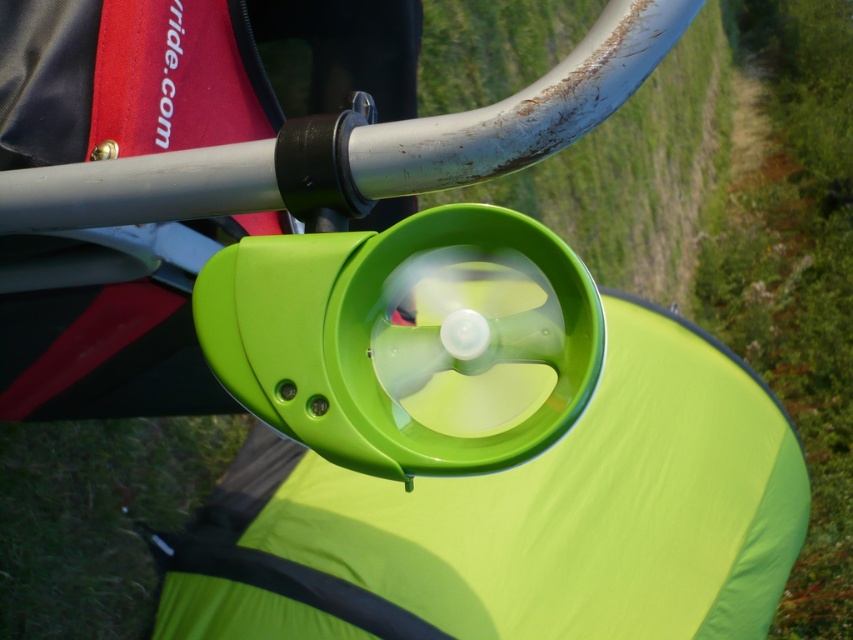
Question: Can you confirm if green matte grass at upper center is smaller than green grass at lower left?

Choices:
 (A) yes
 (B) no

Answer: (B)

Question: Does green matte grass at upper center appear on the right side of green grass at lower left?

Choices:
 (A) yes
 (B) no

Answer: (A)

Question: Is green matte grass at upper center wider than green grass at lower left?

Choices:
 (A) no
 (B) yes

Answer: (B)

Question: Which object appears closest to the camera in this image?

Choices:
 (A) green matte grass at upper center
 (B) green grass at lower left

Answer: (B)